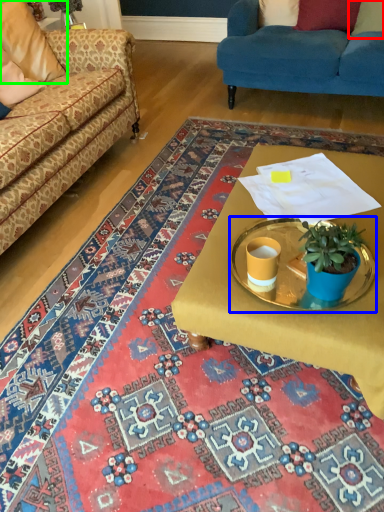
Question: Based on their relative distances, which object is nearer to pillow (highlighted by a red box)? Choose from round table (highlighted by a blue box) and pillow (highlighted by a green box).

Choices:
 (A) round table
 (B) pillow

Answer: (B)